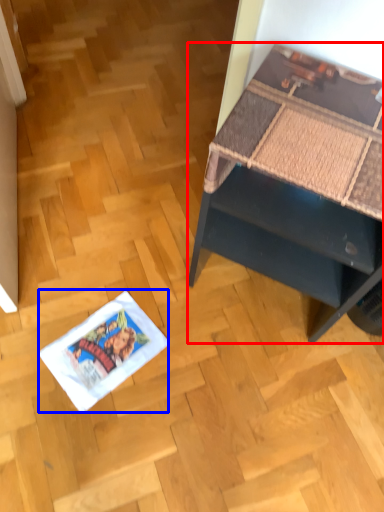
Question: Which point is closer to the camera, desk (highlighted by a red box) or comic book (highlighted by a blue box)?

Choices:
 (A) desk
 (B) comic book

Answer: (A)